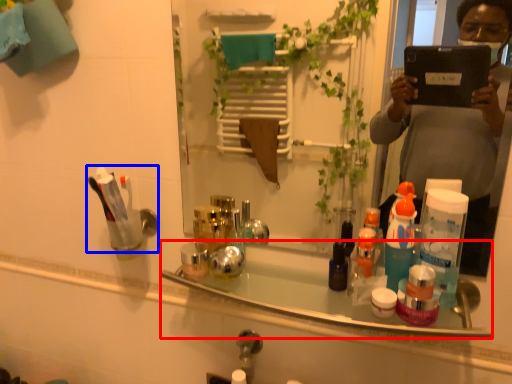
Question: Which point is closer to the camera, bath (highlighted by a red box) or toiletry (highlighted by a blue box)?

Choices:
 (A) bath
 (B) toiletry

Answer: (A)